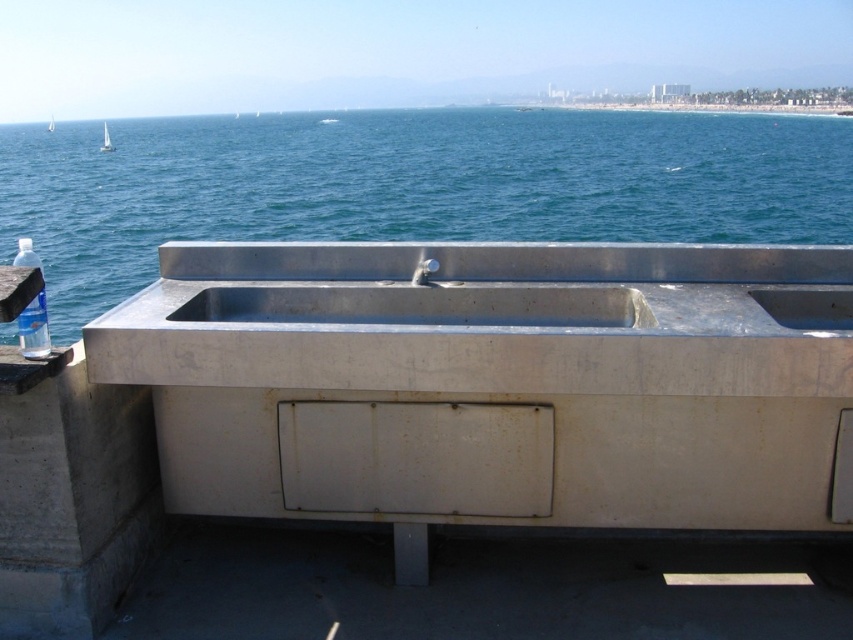
Does point (120, 496) lie in front of point (415, 280)?

That is True.

How much distance is there between gray concrete at lower left and satin nickel faucet at center?

1.32 meters

Locate an element on the screen. gray concrete at lower left is located at coordinates point(71,493).

You are a GUI agent. You are given a task and a screenshot of the screen. Output one action in this format:
    pyautogui.click(x=<x>, y=<y>)
    Task: Click on the gray concrete at lower left
    This screenshot has width=853, height=640.
    Given the screenshot: What is the action you would take?
    pyautogui.click(x=71, y=493)

Is stainless steel sink at center positioned before clear plastic water at left?

No, stainless steel sink at center is further to the viewer.

Between stainless steel sink at center and clear plastic water at left, which one has more height?

clear plastic water at left

This screenshot has width=853, height=640. I want to click on stainless steel sink at center, so click(421, 305).

Find the location of `stainless steel sink at center`. stainless steel sink at center is located at coordinates (421, 305).

Is point (222, 300) closer to camera compared to point (419, 280)?

No, it is not.

Between stainless steel sink at center and satin nickel faucet at center, which one is positioned higher?

satin nickel faucet at center

Is point (386, 300) closer to camera compared to point (431, 272)?

No, it is not.

I want to click on stainless steel sink at center, so point(421,305).